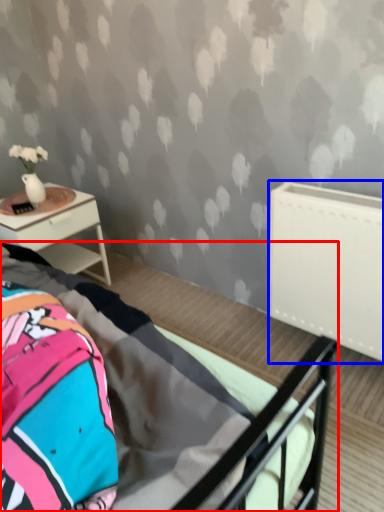
Question: Which object is closer to the camera taking this photo, bed (highlighted by a red box) or radiator (highlighted by a blue box)?

Choices:
 (A) bed
 (B) radiator

Answer: (A)